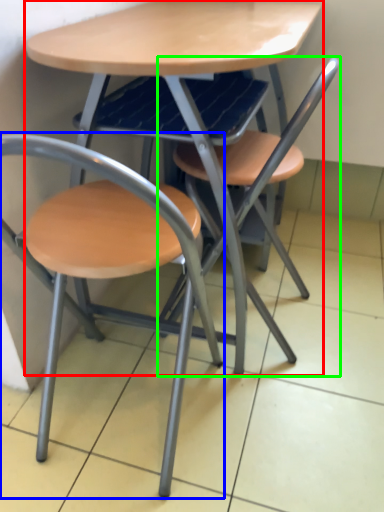
Question: Considering the real-world distances, which object is closest to table (highlighted by a red box)? chair (highlighted by a blue box) or chair (highlighted by a green box).

Choices:
 (A) chair
 (B) chair

Answer: (B)